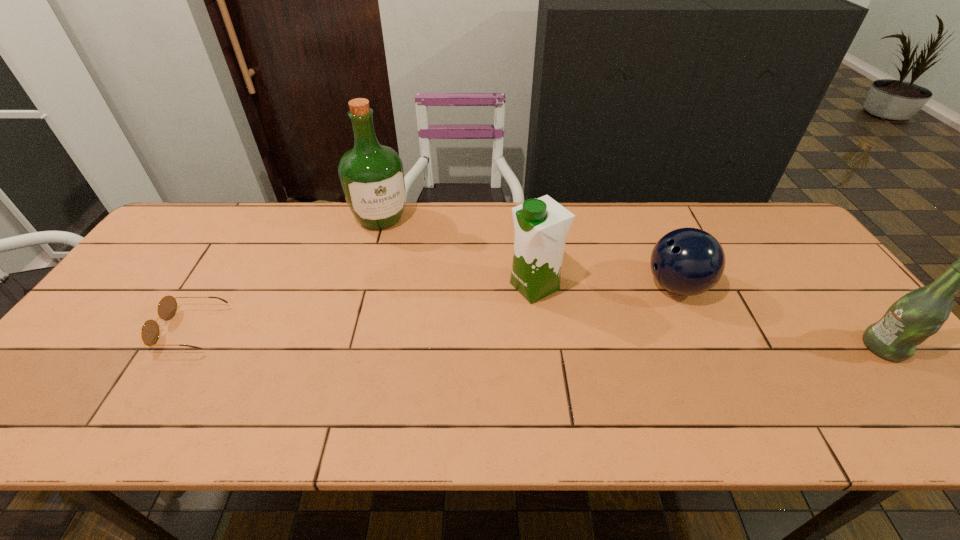
The width and height of the screenshot is (960, 540). Identify the location of vacant point that satisfies the following two spatial constraints: 1. on the front side of the tallest object; 2. on the left side of the second object from right to left. (363, 286).

At what (x,y) coordinates should I click in order to perform the action: click on blank space that satisfies the following two spatial constraints: 1. on the front side of the tallest object; 2. on the surface of the beer bottle. Please return your answer as a coordinate pair (x, y). Looking at the image, I should click on [347, 347].